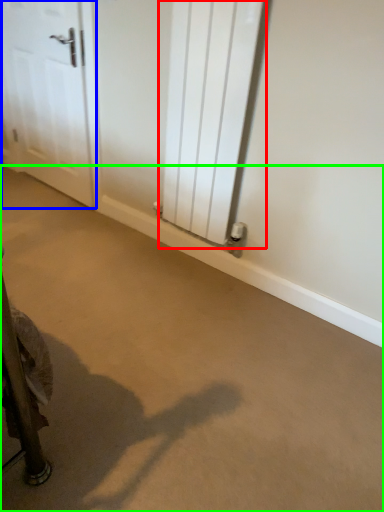
Question: Estimate the real-world distances between objects in this image. Which object is closer to radiator (highlighted by a red box), door (highlighted by a blue box) or concrete (highlighted by a green box)?

Choices:
 (A) door
 (B) concrete

Answer: (B)